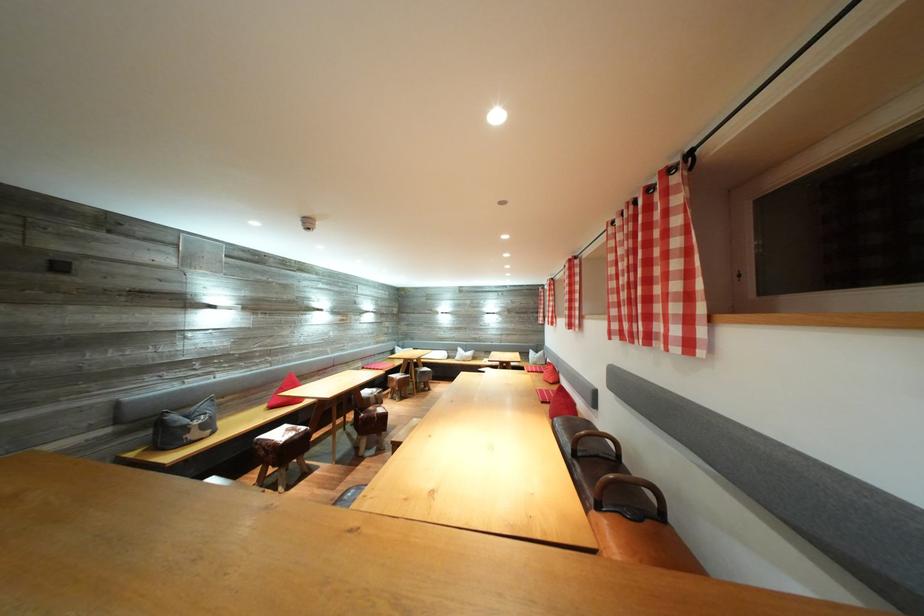
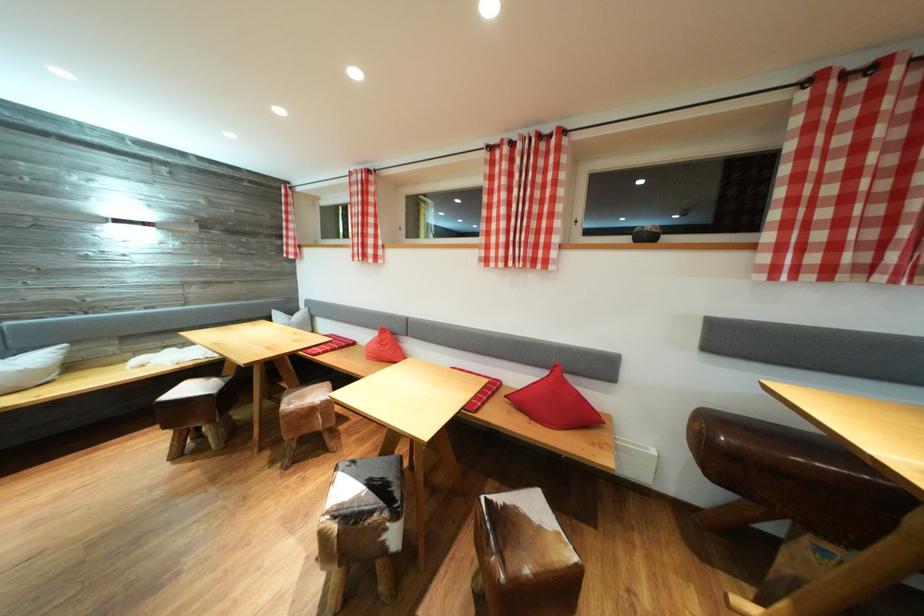
Where in the second image is the point corresponding to [472,355] from the first image?

(14, 358)